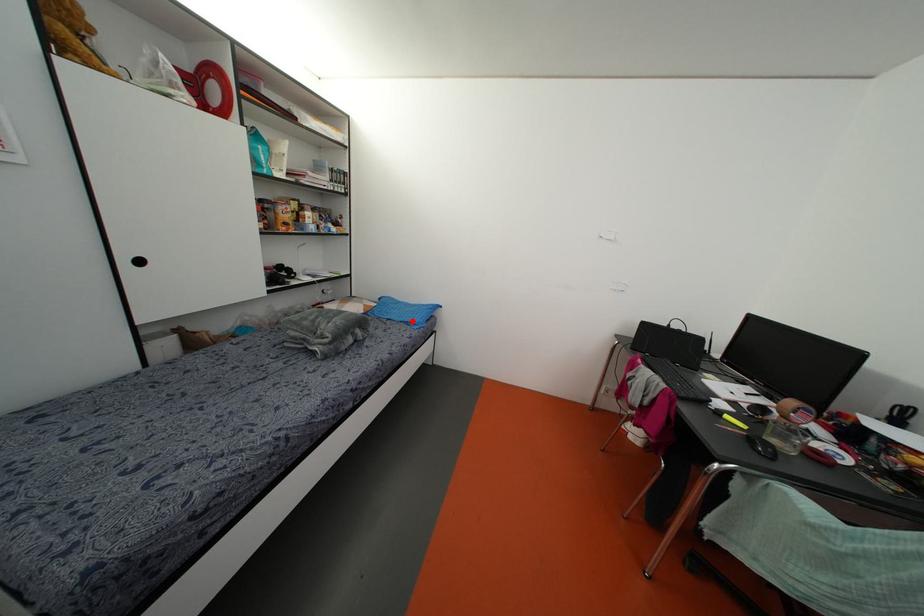
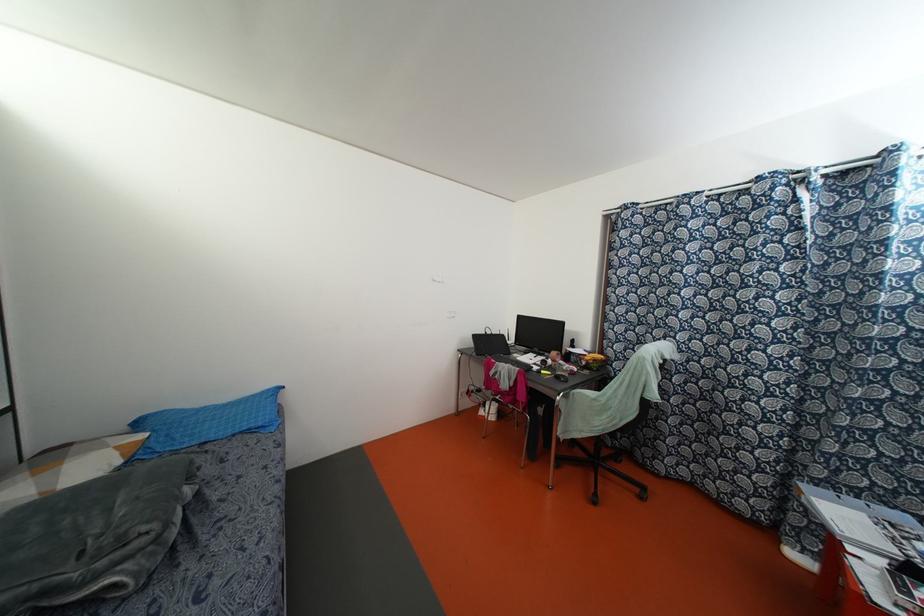
Locate, in the second image, the point that corresponds to the highlighted location in the first image.

(259, 424)